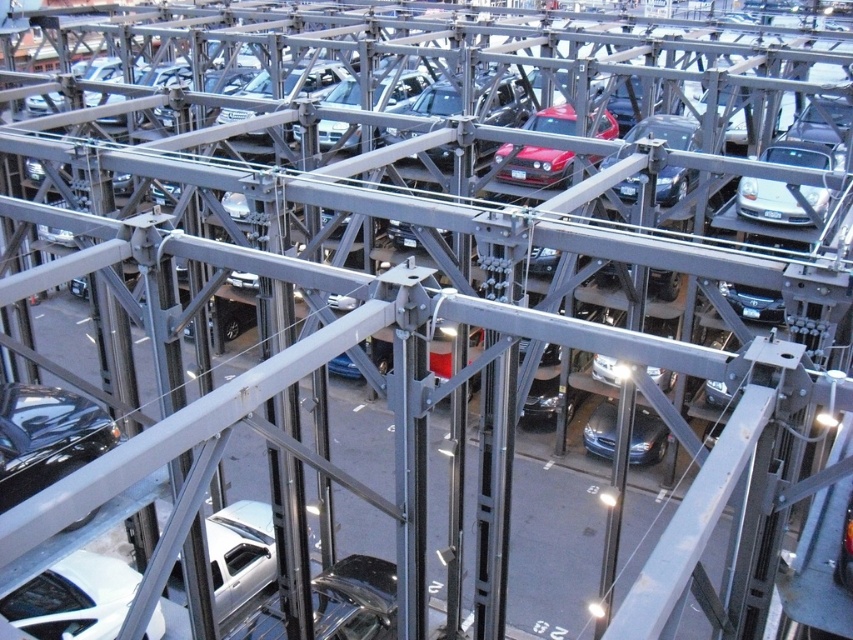
How much distance is there between silver metallic car at center right and shiny black sedan at center?

A distance of 9.27 feet exists between silver metallic car at center right and shiny black sedan at center.

Is silver metallic car at center right positioned at the back of shiny black sedan at center?

That is True.

Locate an element on the screen. Image resolution: width=853 pixels, height=640 pixels. silver metallic car at center right is located at coordinates (769, 202).

Image resolution: width=853 pixels, height=640 pixels. In order to click on silver metallic car at center right in this screenshot , I will do `click(769, 202)`.

You are a GUI agent. You are given a task and a screenshot of the screen. Output one action in this format:
    pyautogui.click(x=<x>, y=<y>)
    Task: Click on the shiny black car at center
    
    Given the screenshot: What is the action you would take?
    pyautogui.click(x=355, y=600)

The image size is (853, 640). Describe the element at coordinates (355, 600) in the screenshot. I see `shiny black car at center` at that location.

The image size is (853, 640). What are the coordinates of `shiny black car at center` in the screenshot? It's located at (355, 600).

Is shiny black car at lower left in front of shiny black sedan at center?

Yes, shiny black car at lower left is in front of shiny black sedan at center.

Does shiny black car at lower left appear under shiny black sedan at center?

Indeed, shiny black car at lower left is positioned under shiny black sedan at center.

What do you see at coordinates (45, 436) in the screenshot? The image size is (853, 640). I see `shiny black car at lower left` at bounding box center [45, 436].

Where is `shiny black car at lower left`? shiny black car at lower left is located at coordinates (45, 436).